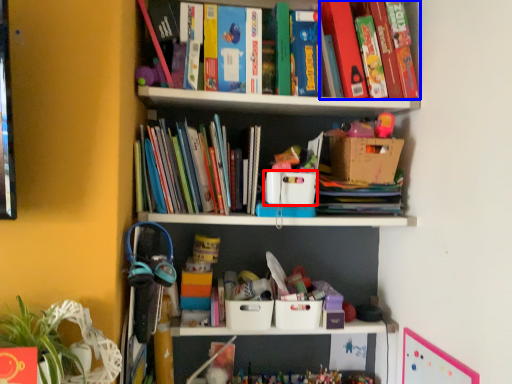
Question: Which of the following is the farthest to the observer, storage box (highlighted by a red box) or book (highlighted by a blue box)?

Choices:
 (A) storage box
 (B) book

Answer: (B)